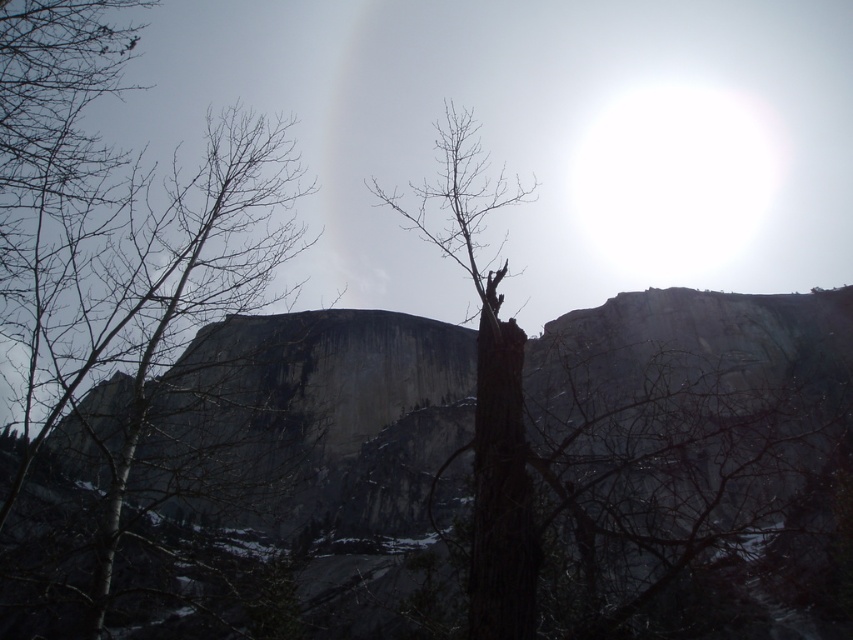
You are standing in front of a granite cliff at center in a winter landscape. You want to take a photo of the cliff with your camera, but you need to ensure you are far enough away to capture the entire structure. Given that your camera has a maximum zoom range of 50 meters, will you be able to capture the entire cliff from your current position?

The granite cliff at center is 58.09 meters away from viewer. Since your camera can only zoom up to 50 meters, you are too far away to capture the entire cliff in one photo without moving closer.

You are an artist trying to paint this scene. You want to ensure the granite cliff at center and the bare wood tree at left are proportionally accurate. Based on their sizes in the image, which object should you draw first to establish the scale of the painting?

The granite cliff at center should be drawn first because it has a larger size compared to the bare wood tree at left, making it the dominant element for setting the scale.

You are an observer standing at the base of the cliff. You notice two trees in the scene. Which tree, the bare wood tree at left or the brown rough bark tree at center, is closer to the cliff face?

The brown rough bark tree at center is closer to the cliff face because the bare wood tree at left is positioned over it, indicating it is in front and thus farther away from the cliff compared to the brown rough bark tree at center.